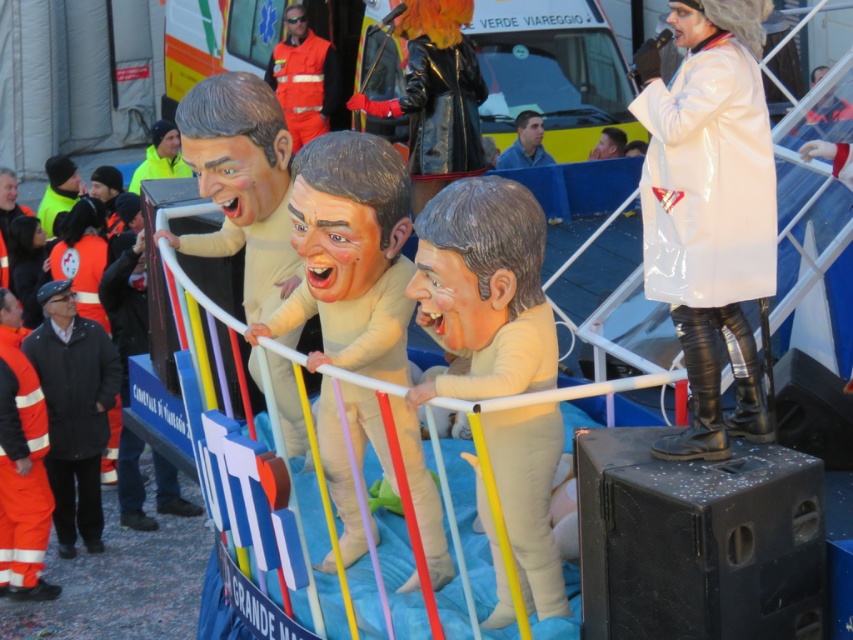
Which is more to the right, black fabric jacket at lower left or blue fabric at center?

Positioned to the right is blue fabric at center.

Consider the image. Does black fabric jacket at lower left come behind blue fabric at center?

No.

This screenshot has width=853, height=640. Find the location of `black fabric jacket at lower left`. black fabric jacket at lower left is located at coordinates (74, 410).

Which is in front, point (534, 380) or point (306, 259)?

Point (534, 380)

Between point (502, 380) and point (416, 477), which one is positioned behind?

The point (416, 477) is more distant.

Identify the location of smooth beige mask at center. This screenshot has width=853, height=640. (485, 289).

Who is more distant from viewer, [653,113] or [531,152]?

Point [531,152]

Is shiny white coat at center thinner than blue fabric at center?

Yes.

Where is `shiny white coat at center`? Image resolution: width=853 pixels, height=640 pixels. shiny white coat at center is located at coordinates (709, 209).